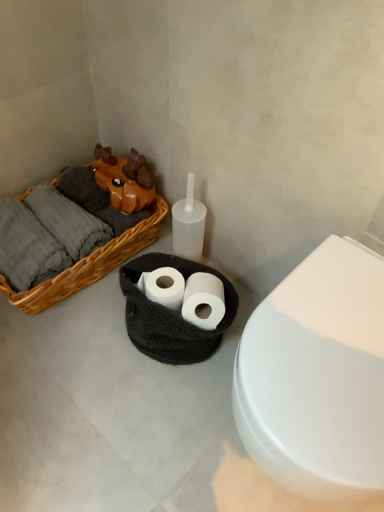
Question: Is white paper at center, placed as the second toilet paper when sorted from left to right, looking in the opposite direction of woven wood basket at left?

Choices:
 (A) yes
 (B) no

Answer: (B)

Question: Is white paper at center, which is the first toilet paper in right-to-left order, not close to woven wood basket at left?

Choices:
 (A) yes
 (B) no

Answer: (B)

Question: Is the position of white paper at center, placed as the second toilet paper when sorted from left to right, more distant than that of woven wood basket at left?

Choices:
 (A) no
 (B) yes

Answer: (A)

Question: Is white paper at center, placed as the second toilet paper when sorted from left to right, closer to camera compared to woven wood basket at left?

Choices:
 (A) no
 (B) yes

Answer: (B)

Question: From the image's perspective, would you say white paper at center, placed as the second toilet paper when sorted from left to right, is positioned over woven wood basket at left?

Choices:
 (A) yes
 (B) no

Answer: (B)

Question: Is white paper at center, placed as the second toilet paper when sorted from left to right, with woven wood basket at left?

Choices:
 (A) no
 (B) yes

Answer: (A)

Question: Considering the relative positions of black crocheted basket at center and white matte toilet paper at center, which appears as the first toilet paper when viewed from the left, in the image provided, is black crocheted basket at center to the left of white matte toilet paper at center, which appears as the first toilet paper when viewed from the left, from the viewer's perspective?

Choices:
 (A) no
 (B) yes

Answer: (A)

Question: Is black crocheted basket at center smaller than white matte toilet paper at center, placed as the second toilet paper when sorted from right to left?

Choices:
 (A) no
 (B) yes

Answer: (A)

Question: Is black crocheted basket at center not near white matte toilet paper at center, which appears as the first toilet paper when viewed from the left?

Choices:
 (A) yes
 (B) no

Answer: (B)

Question: Can you confirm if black crocheted basket at center is taller than white matte toilet paper at center, which appears as the first toilet paper when viewed from the left?

Choices:
 (A) no
 (B) yes

Answer: (B)

Question: Is black crocheted basket at center not within white matte toilet paper at center, placed as the second toilet paper when sorted from right to left?

Choices:
 (A) yes
 (B) no

Answer: (A)

Question: Is black crocheted basket at center wider than white matte toilet paper at center, which appears as the first toilet paper when viewed from the left?

Choices:
 (A) no
 (B) yes

Answer: (B)

Question: Does woven wood basket at left appear on the left side of white paper at center, placed as the second toilet paper when sorted from left to right?

Choices:
 (A) yes
 (B) no

Answer: (A)